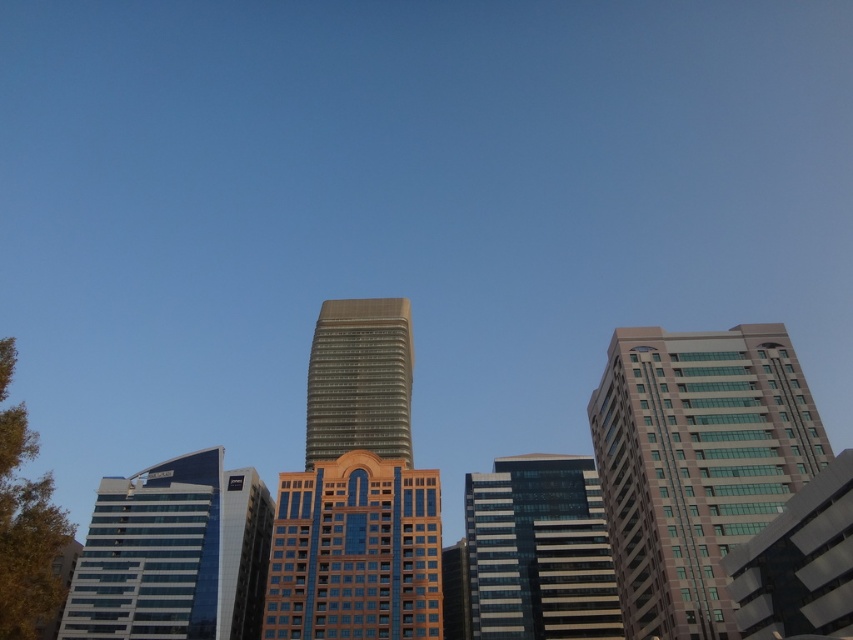
You are standing in the city and want to take a photo of the blue glass building at left. If your camera has a maximum focus range of 300 feet, will you be able to capture it clearly?

The blue glass building at left is 295.80 feet away from the viewer, which is within the camera maximum focus range of 300 feet. So yes, you can capture it clearly.

You are an architect analyzing the cityscape. You notice the gold glass building at center and the glassy black building at center. Which one is smaller in size?

The gold glass building at center has a smaller size compared to the glassy black building at center, so the gold glass building at center is the smaller one.

You are an architect evaluating the city skyline. You notice the gold glass building at center and the glassy black building at center. Which of these two buildings is shorter?

The gold glass building at center is shorter than the glassy black building at center.